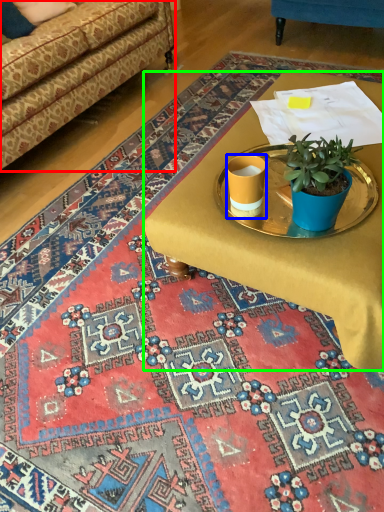
Question: Which object is the farthest from studio couch (highlighted by a red box)? Choose among these: coffee cup (highlighted by a blue box) or desk (highlighted by a green box).

Choices:
 (A) coffee cup
 (B) desk

Answer: (A)